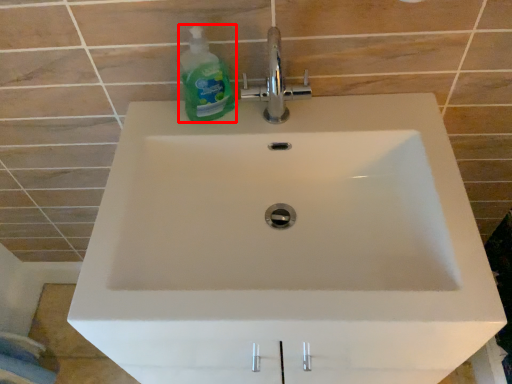
Question: From the image's perspective, what is the correct spatial positioning of cleaning product (annotated by the red box) in reference to tap?

Choices:
 (A) below
 (B) above

Answer: (A)